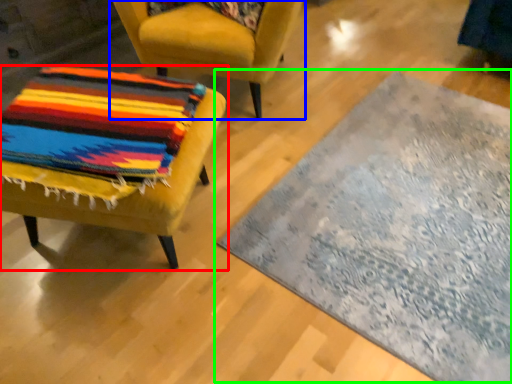
Question: Which object is the closest to the chair (highlighted by a red box)? Choose among these: chair (highlighted by a blue box) or mat (highlighted by a green box).

Choices:
 (A) chair
 (B) mat

Answer: (A)